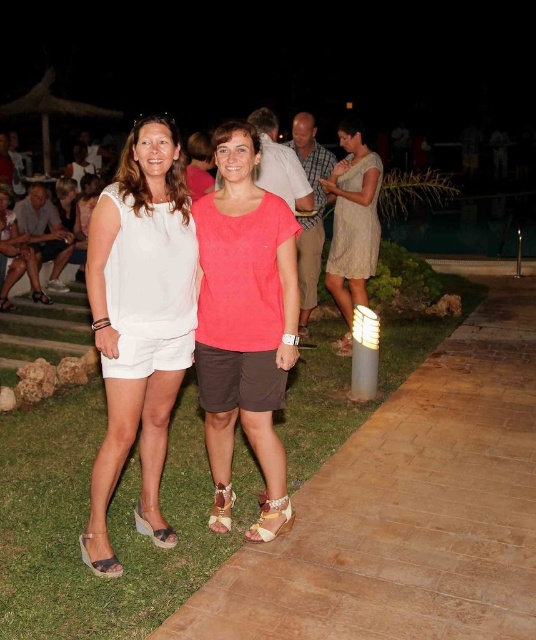
Question: Estimate the real-world distances between objects in this image. Which object is closer to the leather sandal at lower center?

Choices:
 (A) leather sandal at center
 (B) white fabric sandal at lower left
 (C) white cotton shorts at center
 (D) leather wedge sandal at lower left

Answer: (A)

Question: Which of the following is the farthest from the observer?

Choices:
 (A) white fabric sandal at lower left
 (B) leather sandal at center
 (C) coral matte t-shirt at center

Answer: (A)

Question: Which of the following is the farthest from the observer?

Choices:
 (A) (262, 524)
 (B) (207, 520)

Answer: (B)

Question: Is matte black wedge sandal at lower left to the left of white fabric sandal at lower left from the viewer's perspective?

Choices:
 (A) no
 (B) yes

Answer: (A)

Question: Observing the image, what is the correct spatial positioning of coral matte t-shirt at center in reference to leather sandal at lower center?

Choices:
 (A) right
 (B) left

Answer: (B)

Question: From the image, what is the correct spatial relationship of white cotton shorts at center in relation to leather sandal at lower center?

Choices:
 (A) right
 (B) left

Answer: (B)